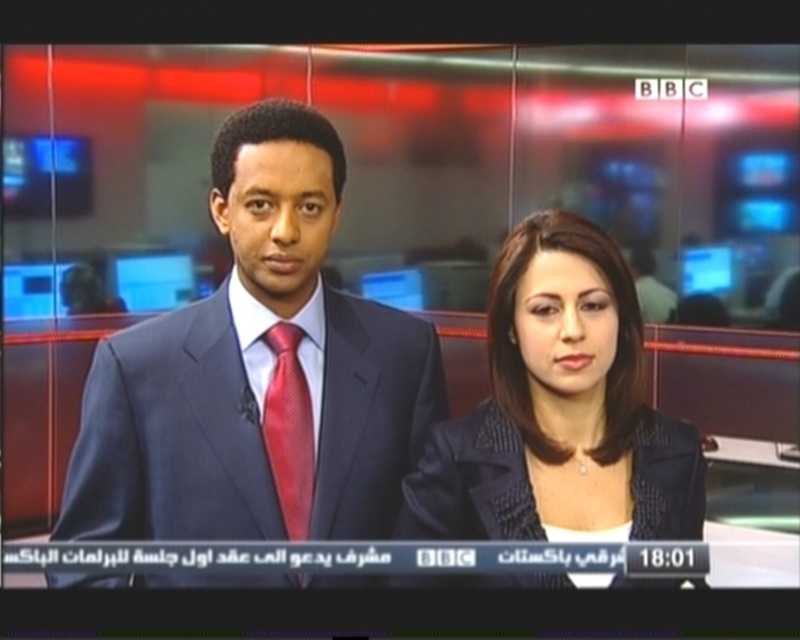
You are a graphic designer working on a layout for the BBC news broadcast. You need to place a logo at the point labeled point (x=258, y=372). Which object will the logo overlap with?

The logo will overlap with the matte black suit at center because the point (x=258, y=372) corresponds to that object.

Based on the photo, you are a costume designer preparing for a TV show and need to determine which piece of clothing is taller between the matte black suit at center and the matte black blazer at center in the studio setup. Based on the scene, which one is taller?

The matte black suit at center is much taller than the matte black blazer at center according to the description.

You are a costume designer preparing for a TV show. You need to determine which item from the image has a taller vertical dimension between the matte black blazer at center and the shiny silk tie at center. Which one is taller?

The matte black blazer at center is taller than the shiny silk tie at center according to the description.